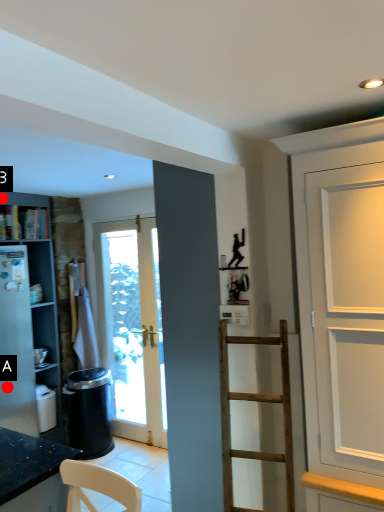
Question: Two points are circled on the image, labeled by A and B beside each circle. Which point appears farthest from the camera in this image?

Choices:
 (A) A is further
 (B) B is further

Answer: (B)